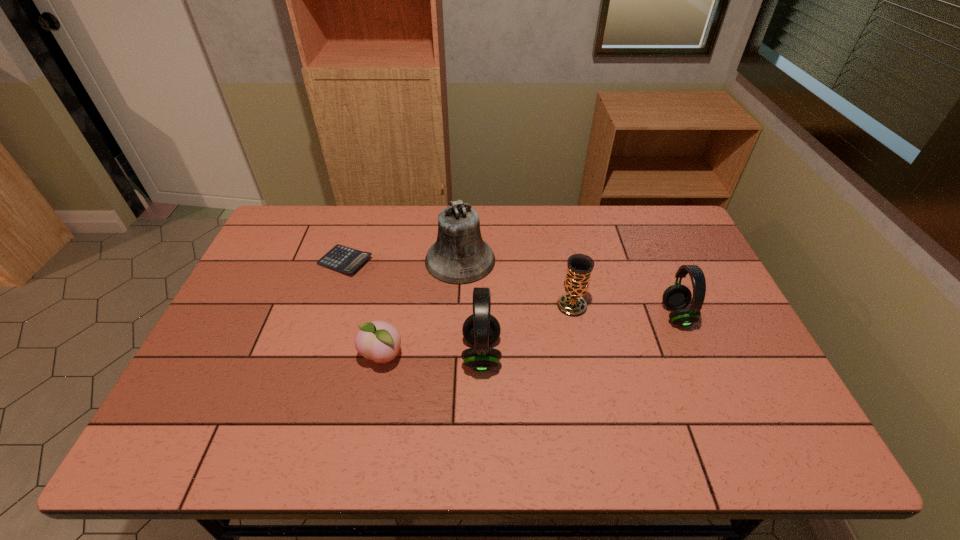
Identify the location of blank space located 0.100m on the ear cups of the right headset. (727, 315).

In order to click on vacant position located on the right of the calculator in this screenshot , I will do `click(460, 261)`.

This screenshot has height=540, width=960. I want to click on free region located on the back of the chalice, so click(554, 217).

I want to click on free spot located 0.300m on the right of the bell, so click(x=589, y=260).

You are a GUI agent. You are given a task and a screenshot of the screen. Output one action in this format:
    pyautogui.click(x=<x>, y=<y>)
    Task: Click on the vacant space situated on the right of the peach
    
    Given the screenshot: What is the action you would take?
    pyautogui.click(x=446, y=357)

Locate an element on the screen. calculator that is positioned at the far edge is located at coordinates (340, 258).

Where is `bell that is at the far edge`? This screenshot has width=960, height=540. bell that is at the far edge is located at coordinates (459, 256).

Where is `object at the near edge`? The image size is (960, 540). object at the near edge is located at coordinates (481, 329).

Locate an element on the screen. object at the right edge is located at coordinates (677, 297).

In the image, there is a desktop. At what (x,y) coordinates should I click in order to perform the action: click on vacant space at the far edge. Please return your answer as a coordinate pair (x, y). This screenshot has height=540, width=960. Looking at the image, I should click on (427, 247).